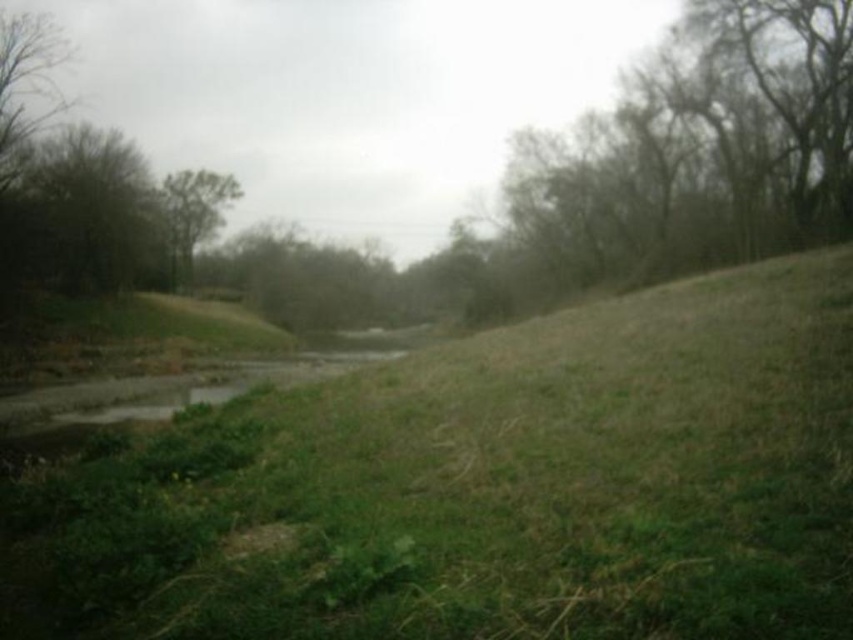
Question: Which of these objects is positioned closest to the green grass at center?

Choices:
 (A) green leafy tree at center
 (B) green leafy tree at upper left

Answer: (B)

Question: Which point is farther to the camera?

Choices:
 (A) green leafy tree at center
 (B) green grass at center

Answer: (A)

Question: Is green grass at center behind green leafy tree at upper left?

Choices:
 (A) yes
 (B) no

Answer: (B)

Question: Which of the following is the farthest from the observer?

Choices:
 (A) (219, 202)
 (B) (343, 481)

Answer: (A)

Question: Is green grass at center below green leafy tree at center?

Choices:
 (A) no
 (B) yes

Answer: (B)

Question: Is green grass at center positioned at the back of green leafy tree at upper left?

Choices:
 (A) yes
 (B) no

Answer: (B)